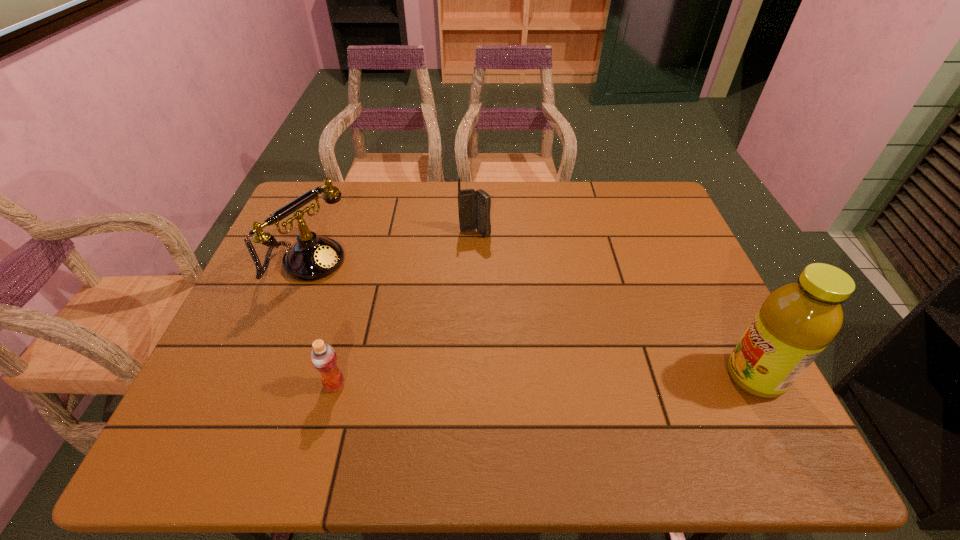
Find the location of a particular element. The image size is (960, 540). free space on the desktop that is between the second object from left to right and the tallest object and is positioned on the keyboard of the cellular telephone is located at coordinates (514, 381).

Where is `vacant space on the desktop that is between the second object from left to right and the tallest object and is positioned on the dial of the leftmost object`? vacant space on the desktop that is between the second object from left to right and the tallest object and is positioned on the dial of the leftmost object is located at coordinates (527, 381).